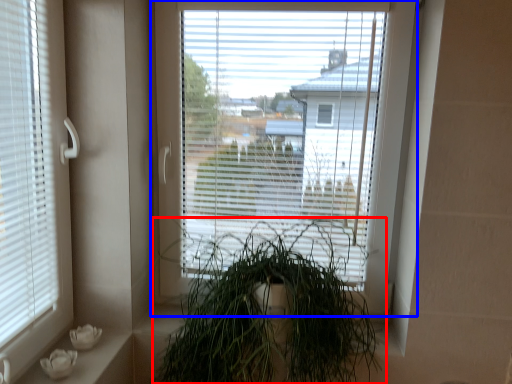
Question: Which of the following is the closest to the observer, houseplant (highlighted by a red box) or window (highlighted by a blue box)?

Choices:
 (A) houseplant
 (B) window

Answer: (A)